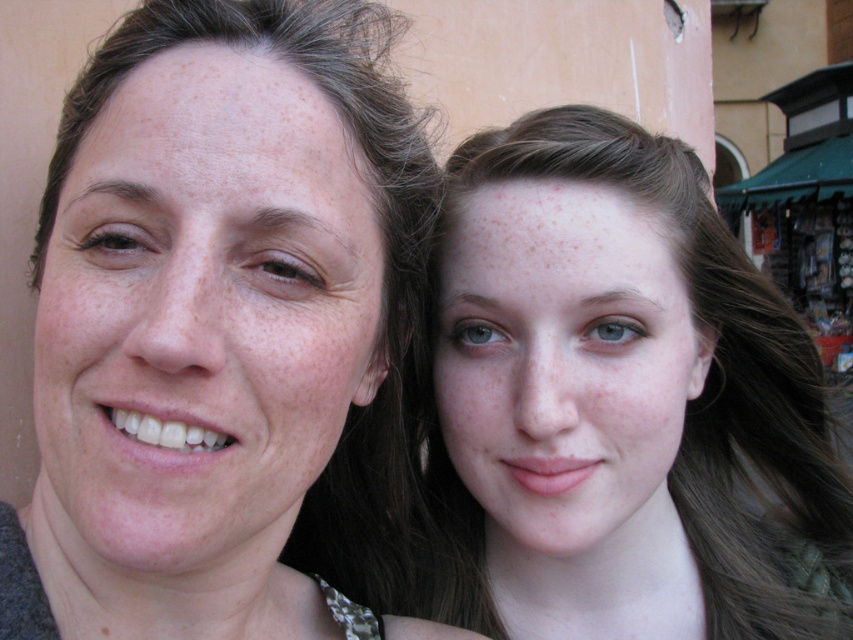
Question: Is matte skin at center positioned in front of smooth skin face at upper right?

Choices:
 (A) no
 (B) yes

Answer: (B)

Question: Is matte skin at center above smooth skin face at upper right?

Choices:
 (A) no
 (B) yes

Answer: (B)

Question: Can you confirm if matte skin at center is thinner than smooth skin face at upper right?

Choices:
 (A) no
 (B) yes

Answer: (B)

Question: Which point is closer to the camera taking this photo?

Choices:
 (A) (666, 506)
 (B) (227, 401)

Answer: (B)

Question: Which point appears farthest from the camera in this image?

Choices:
 (A) (332, 243)
 (B) (664, 406)

Answer: (B)

Question: Which of the following is the closest to the observer?

Choices:
 (A) smooth skin face at upper right
 (B) matte skin at center

Answer: (B)